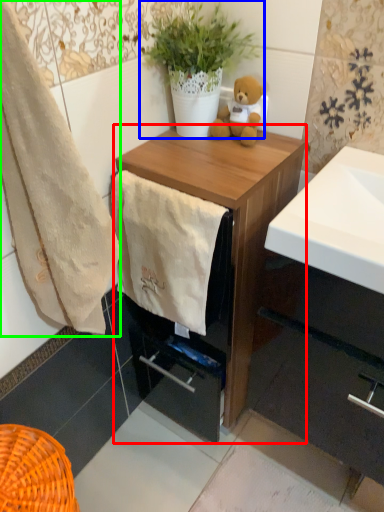
Question: Which object is positioned closest to chest of drawers (highlighted by a red box)? Select from houseplant (highlighted by a blue box) and towel/napkin (highlighted by a green box).

Choices:
 (A) houseplant
 (B) towel/napkin

Answer: (A)